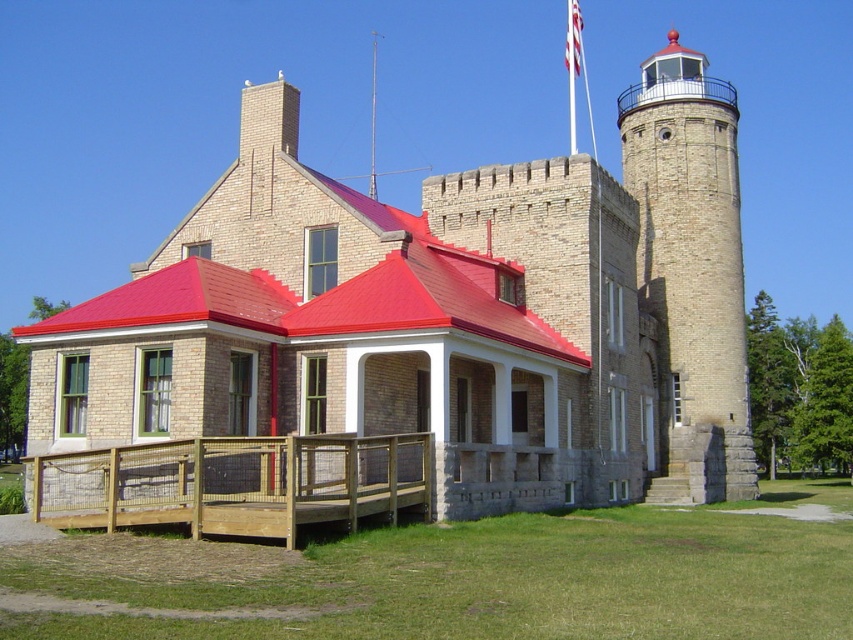
You are standing in front of the brick stone castle at center and want to find the white fabric flag at upper center. In which direction should you look relative to the castle?

The white fabric flag at upper center is to the right of the brick stone castle at center, so you should look to the right side of the castle to find it.

You are a drone operator tasked with capturing aerial footage of the historic stone structure. Your drone is currently positioned above the wooden deck at lower left and needs to fly to the white fabric flag at upper center. Based on the scene, what is the approximate distance your drone must travel to reach the flag from the deck?

The distance between the wooden deck at lower left and the white fabric flag at upper center is 216.80 meters, so the drone must travel approximately 216.80 meters to reach the flag from the deck.